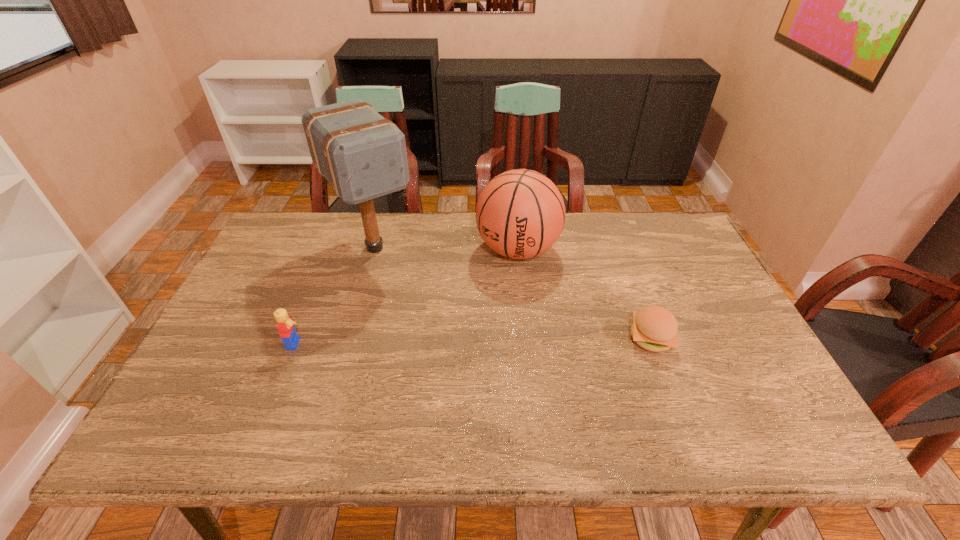
Find the location of a particular element. The height and width of the screenshot is (540, 960). free space between the second shortest object and the shortest object is located at coordinates (474, 341).

Locate an element on the screen. The width and height of the screenshot is (960, 540). vacant area that lies between the hamburger and the mallet is located at coordinates (513, 293).

I want to click on blank region between the mallet and the hamburger, so click(513, 293).

You are a GUI agent. You are given a task and a screenshot of the screen. Output one action in this format:
    pyautogui.click(x=<x>, y=<y>)
    Task: Click on the free point between the shortest object and the tallest object
    The height and width of the screenshot is (540, 960).
    Given the screenshot: What is the action you would take?
    pyautogui.click(x=513, y=293)

You are a GUI agent. You are given a task and a screenshot of the screen. Output one action in this format:
    pyautogui.click(x=<x>, y=<y>)
    Task: Click on the empty space between the Lego and the mallet
    The height and width of the screenshot is (540, 960).
    Given the screenshot: What is the action you would take?
    pyautogui.click(x=336, y=295)

The image size is (960, 540). In order to click on free space between the mallet and the basketball in this screenshot , I will do `click(446, 249)`.

Find the location of a particular element. The image size is (960, 540). vacant area between the second shortest object and the rightmost object is located at coordinates (474, 341).

The height and width of the screenshot is (540, 960). Find the location of `vacant space that is in between the mallet and the second object from right to left`. vacant space that is in between the mallet and the second object from right to left is located at coordinates (446, 249).

Where is `vacant region between the basketball and the mallet`? The width and height of the screenshot is (960, 540). vacant region between the basketball and the mallet is located at coordinates (446, 249).

Where is `vacant region between the tallest object and the rightmost object`? The width and height of the screenshot is (960, 540). vacant region between the tallest object and the rightmost object is located at coordinates (513, 293).